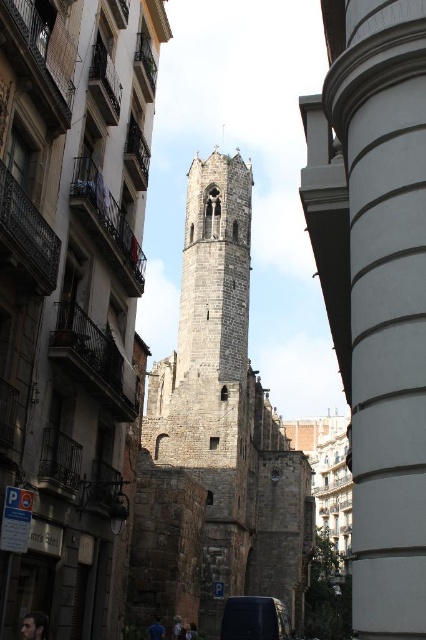
Question: Which object is closer to the camera taking this photo?

Choices:
 (A) dark gray stone tower at center
 (B) dark blue matte van at center

Answer: (B)

Question: In this image, where is white smooth column at center right located relative to dark blue matte van at center?

Choices:
 (A) left
 (B) right

Answer: (B)

Question: Can you confirm if white smooth column at center right is bigger than dark blue matte van at center?

Choices:
 (A) no
 (B) yes

Answer: (B)

Question: Which object appears farthest from the camera in this image?

Choices:
 (A) dark blue matte van at center
 (B) dark gray stone tower at center
 (C) white smooth column at center right

Answer: (B)

Question: Estimate the real-world distances between objects in this image. Which object is farther from the dark gray stone tower at center?

Choices:
 (A) white smooth column at center right
 (B) dark blue matte van at center

Answer: (A)

Question: From the image, what is the correct spatial relationship of dark gray stone tower at center in relation to white smooth column at center right?

Choices:
 (A) left
 (B) right

Answer: (A)